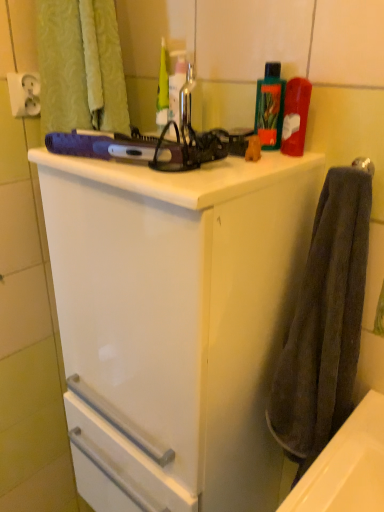
This screenshot has height=512, width=384. Describe the element at coordinates (325, 322) in the screenshot. I see `dark gray towel at right` at that location.

Where is `metallic silver faucet at upper center`? metallic silver faucet at upper center is located at coordinates (186, 103).

Image resolution: width=384 pixels, height=512 pixels. What do you see at coordinates (24, 94) in the screenshot? I see `white plastic socket at upper left` at bounding box center [24, 94].

You are a GUI agent. You are given a task and a screenshot of the screen. Output one action in this format:
    pyautogui.click(x=<x>, y=<y>)
    Task: Click on the white glossy cabinet at upper center
    The image size is (384, 512).
    Given the screenshot: What is the action you would take?
    pyautogui.click(x=175, y=322)

Locate an element on the screen. This screenshot has width=384, height=512. translucent plastic bottle at upper center is located at coordinates (176, 83).

Identify the location of dark gray towel at right. Image resolution: width=384 pixels, height=512 pixels. (325, 322).

Is metallic silver faucet at upper center not near translucent plastic bottle at upper center?

No, metallic silver faucet at upper center is not far away from translucent plastic bottle at upper center.

Does metallic silver faucet at upper center have a lesser height compared to translucent plastic bottle at upper center?

Indeed, metallic silver faucet at upper center has a lesser height compared to translucent plastic bottle at upper center.

How many degrees apart are the facing directions of metallic silver faucet at upper center and translucent plastic bottle at upper center?

8.37e-05 degrees separate the facing orientations of metallic silver faucet at upper center and translucent plastic bottle at upper center.

Would you say white plastic socket at upper left is inside or outside white glossy cabinet at upper center?

white plastic socket at upper left is not enclosed by white glossy cabinet at upper center.

Which is more to the left, white plastic socket at upper left or white glossy cabinet at upper center?

Positioned to the left is white plastic socket at upper left.

Is white plastic socket at upper left facing towards white glossy cabinet at upper center?

No, white plastic socket at upper left is not facing towards white glossy cabinet at upper center.

Is white plastic socket at upper left far from white glossy cabinet at upper center?

No, white plastic socket at upper left is in close proximity to white glossy cabinet at upper center.

Is metallic silver faucet at upper center next to green plastic bottle at upper right and touching it?

No, metallic silver faucet at upper center is not making contact with green plastic bottle at upper right.

Does metallic silver faucet at upper center have a greater width compared to green plastic bottle at upper right?

Yes.

Which object is further away from the camera taking this photo, metallic silver faucet at upper center or green plastic bottle at upper right?

metallic silver faucet at upper center is behind.

Is the depth of green plastic bottle at upper right less than that of dark gray towel at right?

No, green plastic bottle at upper right is further to the viewer.

Which object is positioned more to the left, green plastic bottle at upper right or dark gray towel at right?

From the viewer's perspective, green plastic bottle at upper right appears more on the left side.

Can you tell me how much green plastic bottle at upper right and dark gray towel at right differ in facing direction?

5.56e-05 degrees.

Is green plastic bottle at upper right looking in the opposite direction of dark gray towel at right?

No, dark gray towel at right is not at the back of green plastic bottle at upper right.

Between green plastic bottle at upper right and white plastic socket at upper left, which one is positioned behind?

white plastic socket at upper left is further from the camera.

Would you say green plastic bottle at upper right is outside white plastic socket at upper left?

Absolutely, green plastic bottle at upper right is external to white plastic socket at upper left.

From a real-world perspective, which is physically below, green plastic bottle at upper right or white plastic socket at upper left?

green plastic bottle at upper right.

Considering the sizes of green plastic bottle at upper right and white plastic socket at upper left in the image, is green plastic bottle at upper right wider or thinner than white plastic socket at upper left?

green plastic bottle at upper right is wider than white plastic socket at upper left.

Considering the positions of points (335, 230) and (180, 481), is point (335, 230) farther from camera compared to point (180, 481)?

No, it is in front of (180, 481).

In the scene shown: From a real-world perspective, is dark gray towel at right positioned above or below white glossy cabinet at upper center?

dark gray towel at right is situated higher than white glossy cabinet at upper center in the real world.

How different are the orientations of dark gray towel at right and white glossy cabinet at upper center in degrees?

1.59e-05 degrees separate the facing orientations of dark gray towel at right and white glossy cabinet at upper center.

Find the location of a particular element. The width and height of the screenshot is (384, 512). bath towel on the right of white glossy cabinet at upper center is located at coordinates (325, 322).

Does white plastic socket at upper left turn towards metallic silver faucet at upper center?

No, white plastic socket at upper left is not aimed at metallic silver faucet at upper center.

Looking at their sizes, would you say white plastic socket at upper left is wider or thinner than metallic silver faucet at upper center?

In the image, white plastic socket at upper left appears to be more narrow than metallic silver faucet at upper center.

From the image's perspective, is white plastic socket at upper left positioned above or below metallic silver faucet at upper center?

Based on their image positions, white plastic socket at upper left is located above metallic silver faucet at upper center.

Does white plastic socket at upper left have a greater height compared to metallic silver faucet at upper center?

No.

Locate an element on the screen. This screenshot has height=512, width=384. faucet to the right of translucent plastic bottle at upper center is located at coordinates (186, 103).

In order to click on bathroom cabinet below the white plastic socket at upper left (from the image's perspective) in this screenshot , I will do `click(175, 322)`.

Considering their positions, is white plastic socket at upper left positioned further to dark gray towel at right than white glossy cabinet at upper center?

white plastic socket at upper left is further to dark gray towel at right.

Based on their spatial positions, is dark gray towel at right or translucent plastic bottle at upper center further from green plastic bottle at upper right?

dark gray towel at right.

Which object lies further to the anchor point metallic silver faucet at upper center, translucent plastic bottle at upper center or dark gray towel at right?

Based on the image, dark gray towel at right appears to be further to metallic silver faucet at upper center.

Based on their spatial positions, is dark gray towel at right or metallic silver faucet at upper center closer to white glossy cabinet at upper center?

The object closer to white glossy cabinet at upper center is dark gray towel at right.

Estimate the real-world distances between objects in this image. Which object is further from white plastic socket at upper left, green plastic bottle at upper right or translucent plastic bottle at upper center?

green plastic bottle at upper right is positioned further to the anchor white plastic socket at upper left.

Considering their positions, is white glossy cabinet at upper center positioned closer to dark gray towel at right than green plastic bottle at upper right?

white glossy cabinet at upper center.

When comparing their distances from dark gray towel at right, does white plastic socket at upper left or metallic silver faucet at upper center seem further?

white plastic socket at upper left is further to dark gray towel at right.

When comparing their distances from translucent plastic bottle at upper center, does metallic silver faucet at upper center or green plastic bottle at upper right seem closer?

metallic silver faucet at upper center lies closer to translucent plastic bottle at upper center than the other object.

The image size is (384, 512). I want to click on bottle between white plastic socket at upper left and white glossy cabinet at upper center in the up-down direction, so click(176, 83).

Image resolution: width=384 pixels, height=512 pixels. I want to click on faucet that lies between white plastic socket at upper left and white glossy cabinet at upper center from top to bottom, so click(x=186, y=103).

Where is `bath towel that lies between metallic silver faucet at upper center and white glossy cabinet at upper center from top to bottom`? This screenshot has height=512, width=384. bath towel that lies between metallic silver faucet at upper center and white glossy cabinet at upper center from top to bottom is located at coordinates (325, 322).

This screenshot has width=384, height=512. Find the location of `cleaning product between translucent plastic bottle at upper center and white glossy cabinet at upper center from top to bottom`. cleaning product between translucent plastic bottle at upper center and white glossy cabinet at upper center from top to bottom is located at coordinates (270, 106).